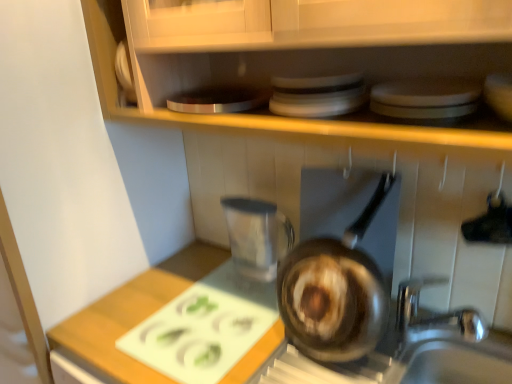
This screenshot has width=512, height=384. I want to click on vacant area on top of white cutting board at center (from a real-world perspective), so click(x=212, y=313).